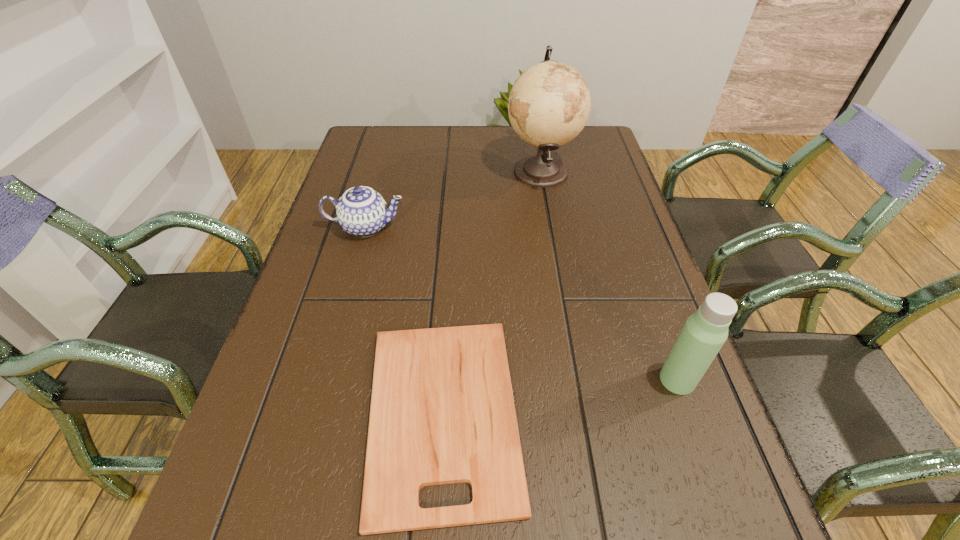
This screenshot has height=540, width=960. Identify the location of empty location between the rightmost object and the chinaware. (521, 303).

The image size is (960, 540). Identify the location of object that is the third closest to the shortest object. [549, 104].

Locate which object is the closest to the tallest object. Please provide its 2D coordinates. Your answer should be formatted as a tuple, i.e. [(x, y)], where the tuple contains the x and y coordinates of a point satisfying the conditions above.

[(361, 211)]

Where is `vacant space that satisfies the following two spatial constraints: 1. on the front-facing side of the third shortest object; 2. on the right side of the tallest object`? vacant space that satisfies the following two spatial constraints: 1. on the front-facing side of the third shortest object; 2. on the right side of the tallest object is located at coordinates (577, 380).

At what (x,y) coordinates should I click in order to perform the action: click on free location that satisfies the following two spatial constraints: 1. on the front-facing side of the tallest object; 2. on the right side of the rightmost object. Please return your answer as a coordinate pair (x, y). Looking at the image, I should click on (577, 380).

In order to click on vacant space that satisfies the following two spatial constraints: 1. on the front-facing side of the second tallest object; 2. on the left side of the farthest object in this screenshot , I will do `click(577, 380)`.

This screenshot has height=540, width=960. Identify the location of vacant space that satisfies the following two spatial constraints: 1. on the front-facing side of the globe; 2. on the left side of the thermos bottle. (577, 380).

You are a GUI agent. You are given a task and a screenshot of the screen. Output one action in this format:
    pyautogui.click(x=<x>, y=<y>)
    Task: Click on the blank space that satisfies the following two spatial constraints: 1. from the spout of the shortest object; 2. on the right side of the second shortest object
    The height and width of the screenshot is (540, 960).
    Given the screenshot: What is the action you would take?
    pyautogui.click(x=314, y=414)

At what (x,y) coordinates should I click in order to perform the action: click on vacant region that satisfies the following two spatial constraints: 1. from the spout of the second farthest object; 2. on the left side of the second tallest object. Please return your answer as a coordinate pair (x, y). Looking at the image, I should click on (324, 380).

Where is `free space that satisfies the following two spatial constraints: 1. from the spout of the third tallest object; 2. on the back side of the shortest object`? The width and height of the screenshot is (960, 540). free space that satisfies the following two spatial constraints: 1. from the spout of the third tallest object; 2. on the back side of the shortest object is located at coordinates (314, 414).